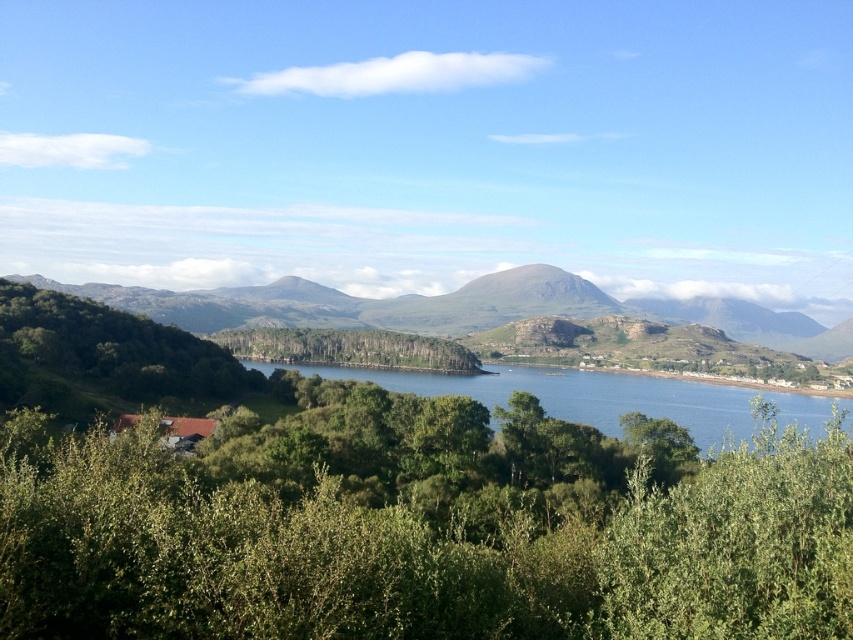
Is green leafy tree at lower left thinner than green textured hillside at center?

Yes.

Is green leafy tree at lower left wider than green textured hillside at center?

No.

Find the location of `green leafy tree at lower left`. green leafy tree at lower left is located at coordinates (421, 531).

Between point (751, 506) and point (415, 339), which one is positioned in front?

Point (751, 506) is in front.

Between green leafy tree at lower left and green leafy tree at center, which one is positioned lower?

Positioned lower is green leafy tree at lower left.

Does point (485, 499) come behind point (440, 365)?

No.

I want to click on green leafy tree at lower left, so click(x=421, y=531).

Is green leafy tree at lower left shorter than green leafy tree at left?

Indeed, green leafy tree at lower left has a lesser height compared to green leafy tree at left.

Between point (384, 584) and point (1, 369), which one is positioned in front?

Point (384, 584)

Is point (534, 541) in front of point (160, 340)?

That is True.

Image resolution: width=853 pixels, height=640 pixels. I want to click on green leafy tree at lower left, so click(421, 531).